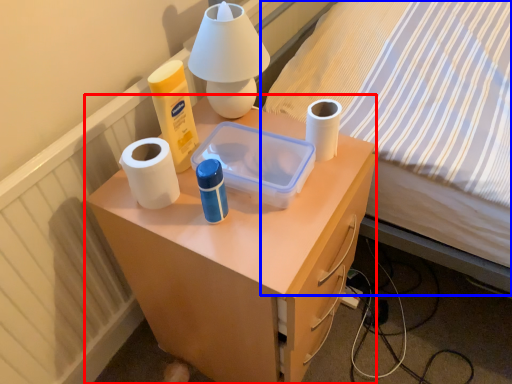
Question: Which object appears farthest to the camera in this image, desk (highlighted by a red box) or bed (highlighted by a blue box)?

Choices:
 (A) desk
 (B) bed

Answer: (A)